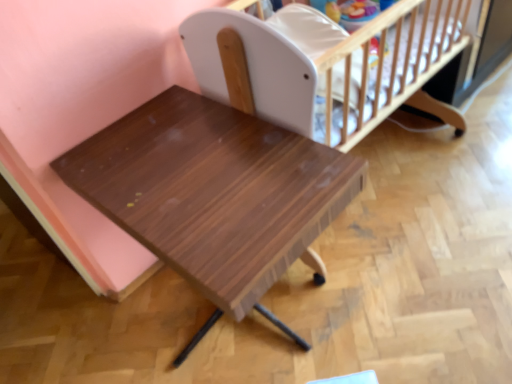
I want to click on white matte infant bed at upper center, so click(x=326, y=65).

What do you see at coordinates (326, 65) in the screenshot? I see `white matte infant bed at upper center` at bounding box center [326, 65].

Measure the distance between wooden table at center and camera.

wooden table at center and camera are 29.87 inches apart.

What do you see at coordinates (215, 195) in the screenshot? I see `wooden table at center` at bounding box center [215, 195].

Locate an element on the screen. wooden table at center is located at coordinates (215, 195).

You are a GUI agent. You are given a task and a screenshot of the screen. Output one action in this format:
    pyautogui.click(x=<x>, y=<y>)
    Task: Click on the white matte infant bed at upper center
    The height and width of the screenshot is (384, 512).
    Given the screenshot: What is the action you would take?
    pyautogui.click(x=326, y=65)

Visually, is white matte infant bed at upper center positioned to the left or to the right of wooden table at center?

white matte infant bed at upper center is to the right of wooden table at center.

Does white matte infant bed at upper center come behind wooden table at center?

Yes, it is behind wooden table at center.

Which is nearer, (287, 12) or (129, 176)?

Point (287, 12) is farther from the camera than point (129, 176).

From the image's perspective, is white matte infant bed at upper center beneath wooden table at center?

No.

From a real-world perspective, which is physically above, white matte infant bed at upper center or wooden table at center?

From a 3D spatial view, white matte infant bed at upper center is above.

In terms of width, does white matte infant bed at upper center look wider or thinner when compared to wooden table at center?

In the image, white matte infant bed at upper center appears to be more narrow than wooden table at center.

Is white matte infant bed at upper center shorter than wooden table at center?

Correct, white matte infant bed at upper center is not as tall as wooden table at center.

Which of these two, white matte infant bed at upper center or wooden table at center, is bigger?

With larger size is wooden table at center.

Can we say white matte infant bed at upper center lies outside wooden table at center?

white matte infant bed at upper center is positioned outside wooden table at center.

Are white matte infant bed at upper center and wooden table at center far apart?

white matte infant bed at upper center is near wooden table at center, not far away.

Is white matte infant bed at upper center oriented towards wooden table at center?

No, white matte infant bed at upper center is not turned towards wooden table at center.

How different are the orientations of white matte infant bed at upper center and wooden table at center in degrees?

2.48 degrees.

Measure the distance from white matte infant bed at upper center to wooden table at center.

white matte infant bed at upper center is 12.19 inches away from wooden table at center.

In the image, there is a white matte infant bed at upper center. Where is `table below it (from a real-world perspective)`? The image size is (512, 384). table below it (from a real-world perspective) is located at coordinates (215, 195).

Is wooden table at center at the right side of white matte infant bed at upper center?

Incorrect, wooden table at center is not on the right side of white matte infant bed at upper center.

In the image, is wooden table at center positioned in front of or behind white matte infant bed at upper center?

wooden table at center is positioned closer to the viewer than white matte infant bed at upper center.

Is point (88, 152) closer to viewer compared to point (198, 65)?

Yes, point (88, 152) is closer to viewer.

From the image's perspective, which one is positioned higher, wooden table at center or white matte infant bed at upper center?

white matte infant bed at upper center appears higher in the image.

From a real-world perspective, is wooden table at center physically located above or below white matte infant bed at upper center?

From a real-world perspective, wooden table at center is physically below white matte infant bed at upper center.

In terms of width, does wooden table at center look wider or thinner when compared to white matte infant bed at upper center?

Clearly, wooden table at center has more width compared to white matte infant bed at upper center.

Who is taller, wooden table at center or white matte infant bed at upper center?

With more height is wooden table at center.

Which of these two, wooden table at center or white matte infant bed at upper center, is smaller?

white matte infant bed at upper center.

Is wooden table at center not inside white matte infant bed at upper center?

That's correct, wooden table at center is outside of white matte infant bed at upper center.

Are wooden table at center and white matte infant bed at upper center far apart?

No, there isn't a large distance between wooden table at center and white matte infant bed at upper center.

Is wooden table at center turned away from white matte infant bed at upper center?

That's not correct — wooden table at center is not looking away from white matte infant bed at upper center.

Measure the distance between wooden table at center and white matte infant bed at upper center.

wooden table at center is 12.19 inches away from white matte infant bed at upper center.

Where is `table located on the left of white matte infant bed at upper center`? This screenshot has width=512, height=384. table located on the left of white matte infant bed at upper center is located at coordinates (215, 195).

At what (x,y) coordinates should I click in order to perform the action: click on infant bed that is above the wooden table at center (from the image's perspective). Please return your answer as a coordinate pair (x, y). Looking at the image, I should click on (326, 65).

This screenshot has height=384, width=512. In order to click on table below the white matte infant bed at upper center (from a real-world perspective) in this screenshot , I will do `click(215, 195)`.